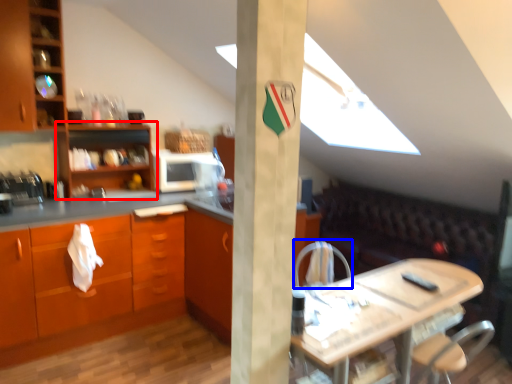
Question: Among these objects, which one is nearest to the camera, shelf (highlighted by a red box) or armchair (highlighted by a blue box)?

Choices:
 (A) shelf
 (B) armchair

Answer: (B)